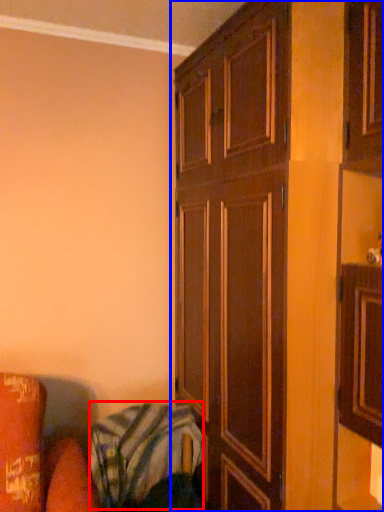
Question: Which object appears closest to the camera in this image, blanket (highlighted by a red box) or cupboard (highlighted by a blue box)?

Choices:
 (A) blanket
 (B) cupboard

Answer: (B)